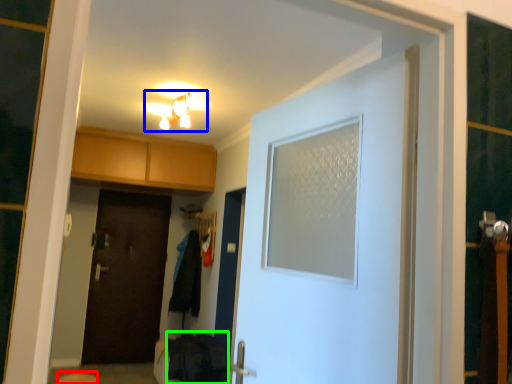
Question: Which object is the closest to the step stool (highlighted by a red box)? Choose among these: light fixture (highlighted by a blue box) or laundry (highlighted by a green box).

Choices:
 (A) light fixture
 (B) laundry

Answer: (B)